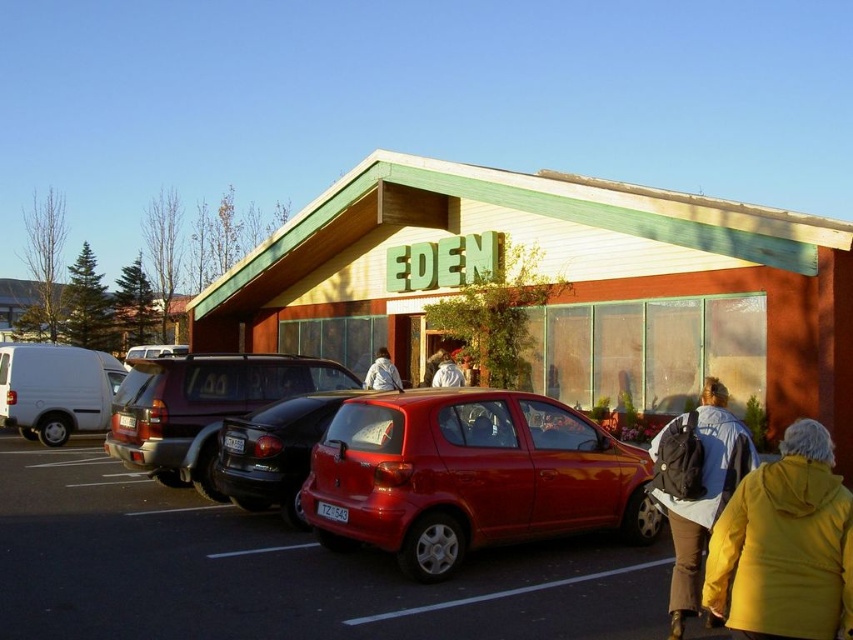
Who is positioned more to the right, wooden siding building at center or white matte van at left?

From the viewer's perspective, wooden siding building at center appears more on the right side.

Which is behind, point (383, 188) or point (61, 408)?

The point (383, 188) is behind.

Locate an element on the screen. Image resolution: width=853 pixels, height=640 pixels. wooden siding building at center is located at coordinates (566, 289).

Describe the element at coordinates (202, 406) in the screenshot. I see `matte black suv at center` at that location.

You are a GUI agent. You are given a task and a screenshot of the screen. Output one action in this format:
    pyautogui.click(x=<x>, y=<y>)
    Task: Click on the matte black suv at center
    
    Given the screenshot: What is the action you would take?
    pyautogui.click(x=202, y=406)

Does white cotton jacket at center appear under black rubber line at lower center?

No.

Who is more forward, (x=440, y=364) or (x=280, y=545)?

Point (x=280, y=545) is in front.

Find the location of `white cotton jacket at center`. white cotton jacket at center is located at coordinates (445, 371).